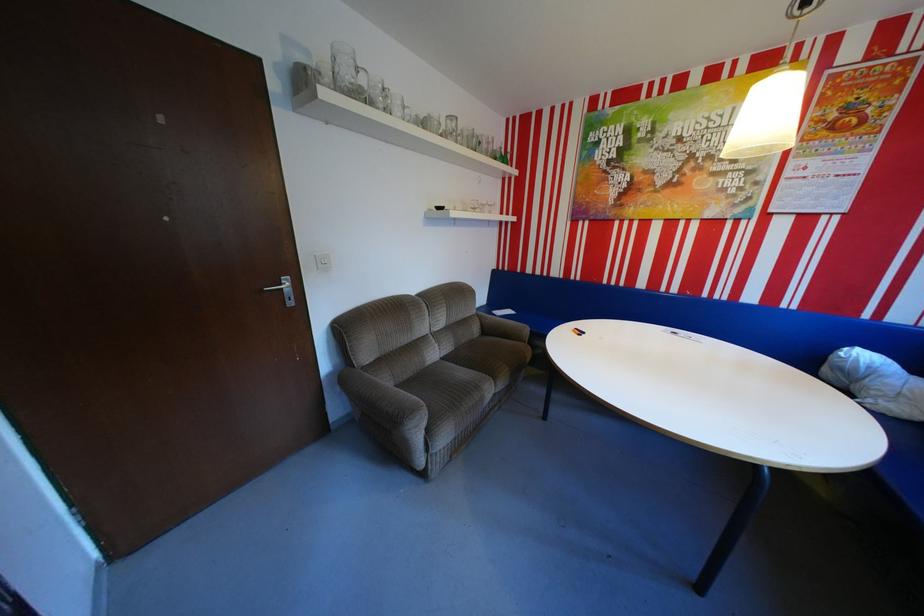
The height and width of the screenshot is (616, 924). I want to click on white pillow, so click(874, 382).